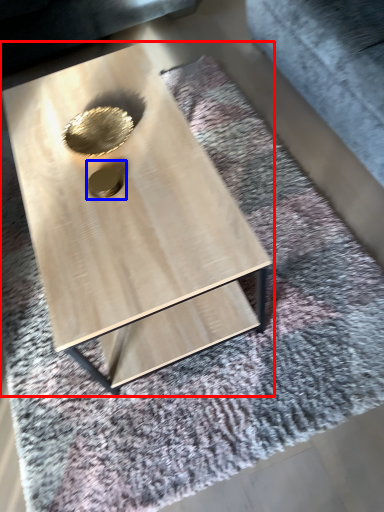
Question: Which object is further to the camera taking this photo, coffee table (highlighted by a red box) or hole (highlighted by a blue box)?

Choices:
 (A) coffee table
 (B) hole

Answer: (B)